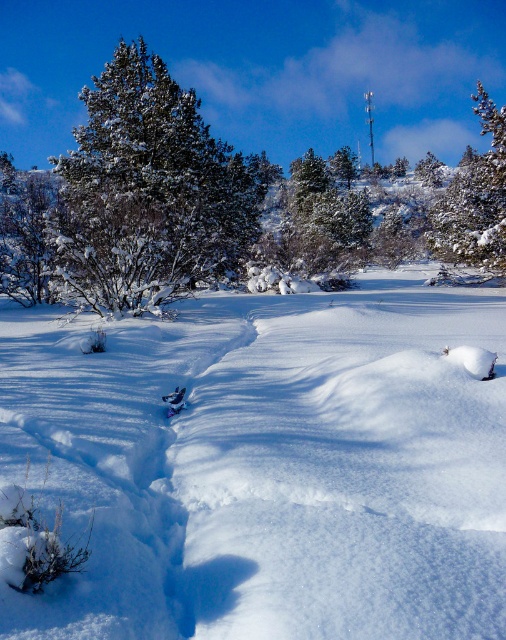
Question: Which of the following is the farthest from the observer?

Choices:
 (A) (481, 237)
 (B) (203, 566)

Answer: (A)

Question: Based on their relative distances, which object is farther from the snow-covered pine tree at upper left?

Choices:
 (A) white fluffy snow at center
 (B) snow-covered pine tree at left

Answer: (A)

Question: Can you confirm if snow-covered pine tree at upper left is positioned above green textured pine at upper right?

Choices:
 (A) no
 (B) yes

Answer: (A)

Question: Does white fluffy snow at center appear under snow-covered pine tree at upper left?

Choices:
 (A) yes
 (B) no

Answer: (A)

Question: Based on their relative distances, which object is farther from the snow-covered pine tree at upper left?

Choices:
 (A) white fluffy snow at center
 (B) snow-covered pine tree at left

Answer: (A)

Question: Does snow-covered pine tree at upper left appear over green textured pine at upper right?

Choices:
 (A) no
 (B) yes

Answer: (A)